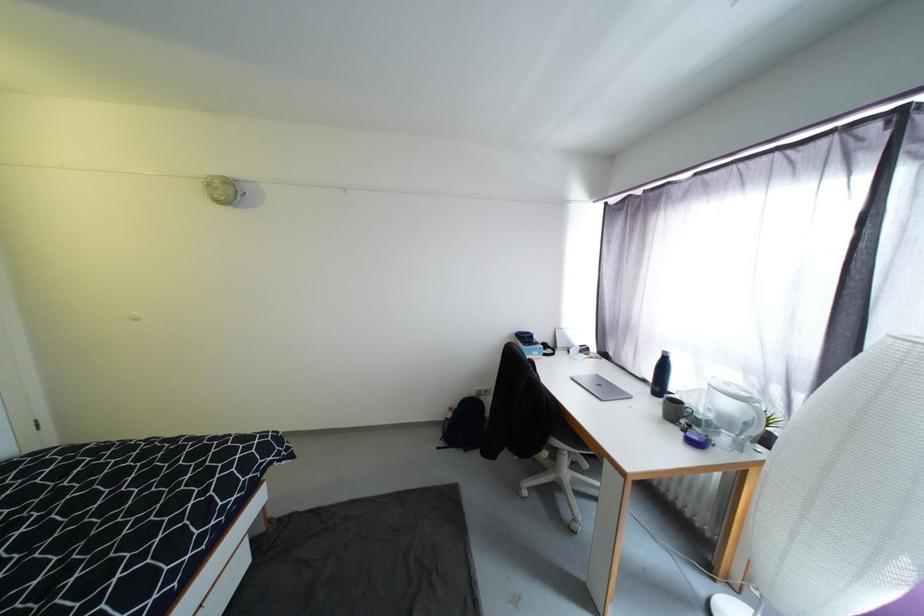
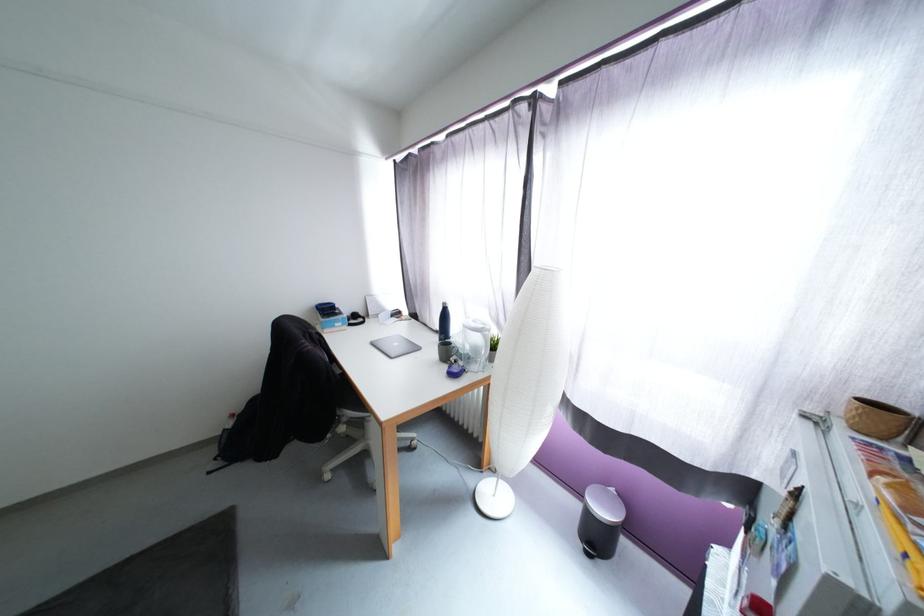
Question: The camera is either moving clockwise (left) or counter-clockwise (right) around the object. The first image is from the beginning of the video and the second image is from the end. Is the camera moving left or right when shooting the video?

Choices:
 (A) Left
 (B) Right

Answer: (A)